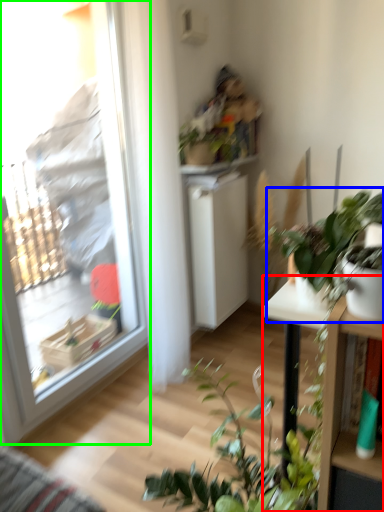
Question: Estimate the real-world distances between objects in this image. Which object is farther from table (highlighted by a red box), houseplant (highlighted by a blue box) or window (highlighted by a green box)?

Choices:
 (A) houseplant
 (B) window

Answer: (B)